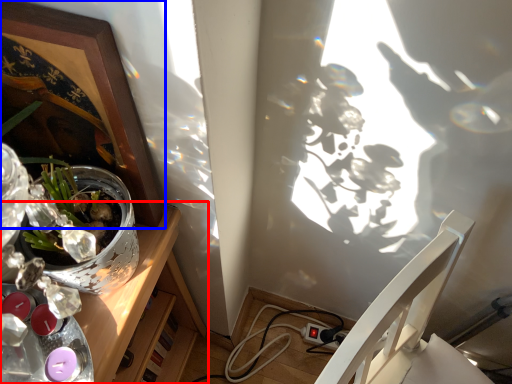
Question: Among these objects, which one is nearest to the camera, desk (highlighted by a red box) or picture frame (highlighted by a blue box)?

Choices:
 (A) desk
 (B) picture frame

Answer: (B)